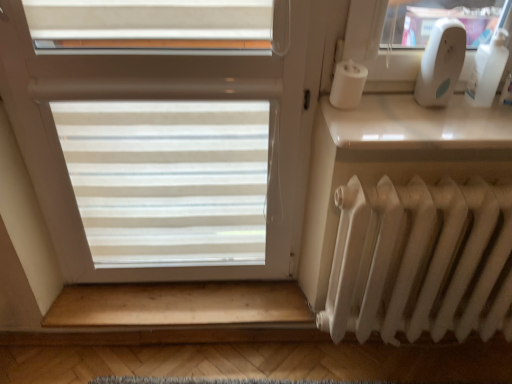
Question: Is white translucent blinds at center not near white glossy window sill at upper right?

Choices:
 (A) no
 (B) yes

Answer: (A)

Question: Is white translucent blinds at center in front of white glossy window sill at upper right?

Choices:
 (A) yes
 (B) no

Answer: (A)

Question: Does white translucent blinds at center have a smaller size compared to white glossy window sill at upper right?

Choices:
 (A) no
 (B) yes

Answer: (A)

Question: Is white glossy window sill at upper right a part of white translucent blinds at center?

Choices:
 (A) no
 (B) yes

Answer: (A)

Question: From a real-world perspective, is white translucent blinds at center beneath white glossy window sill at upper right?

Choices:
 (A) yes
 (B) no

Answer: (A)

Question: Is point (376, 109) positioned closer to the camera than point (237, 306)?

Choices:
 (A) closer
 (B) farther

Answer: (A)

Question: Is white glossy window sill at upper right bigger or smaller than wooden at lower?

Choices:
 (A) big
 (B) small

Answer: (B)

Question: Relative to wooden at lower, is white glossy window sill at upper right in front or behind?

Choices:
 (A) front
 (B) behind

Answer: (A)

Question: Considering the positions of white glossy window sill at upper right and wooden at lower in the image, is white glossy window sill at upper right wider or thinner than wooden at lower?

Choices:
 (A) thin
 (B) wide

Answer: (B)

Question: From the image's perspective, is white glossy window sill at upper right above or below white plastic bottle at upper right?

Choices:
 (A) above
 (B) below

Answer: (B)

Question: Considering their positions, is white glossy window sill at upper right located in front of or behind white plastic bottle at upper right?

Choices:
 (A) front
 (B) behind

Answer: (A)

Question: Is white glossy window sill at upper right wider or thinner than white plastic bottle at upper right?

Choices:
 (A) wide
 (B) thin

Answer: (A)

Question: Looking at the image, does white glossy window sill at upper right seem bigger or smaller compared to white plastic bottle at upper right?

Choices:
 (A) big
 (B) small

Answer: (A)

Question: Would you say white translucent blinds at center is inside or outside white glossy window sill at upper right?

Choices:
 (A) inside
 (B) outside

Answer: (B)

Question: Is white translucent blinds at center taller or shorter than white glossy window sill at upper right?

Choices:
 (A) tall
 (B) short

Answer: (A)